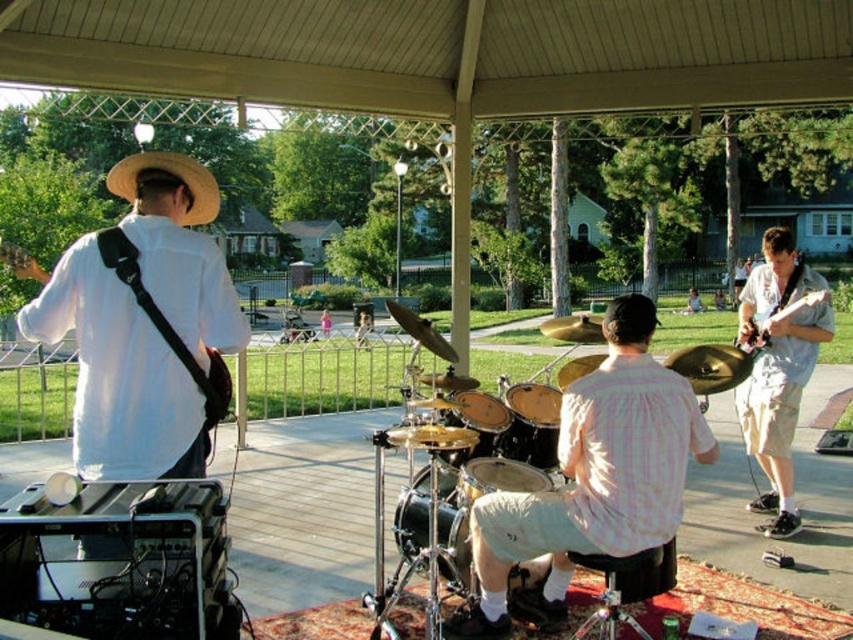
You are a photographer standing behind the pink checkered shirt at center and the shiny gold drum at center. You want to take a photo of both objects in the same frame. Do you think you can move backward enough to include both in the frame without zooming in? Please explain your reasoning.

The pink checkered shirt at center is 28.34 inches away from the shiny gold drum at center. Since they are relatively close to each other, moving backward slightly should allow both to fit in the frame without needing to zoom in.

You are standing at the camera position and want to walk to the point marked at coordinates (517, 406). How far will you have to walk to reach that point?

The point marked at coordinates (517, 406) is 4.91 meters away from the camera, so you will have to walk 4.91 meters to reach it.

You are a photographer standing at the back of the pavilion and want to capture both the pink checkered shirt at center and the shiny gold drum at center in a single photo. Which object should you focus on first to ensure both are in frame?

The pink checkered shirt at center is much taller than the shiny gold drum at center, so you should focus on the pink checkered shirt at center first to ensure both are in frame.